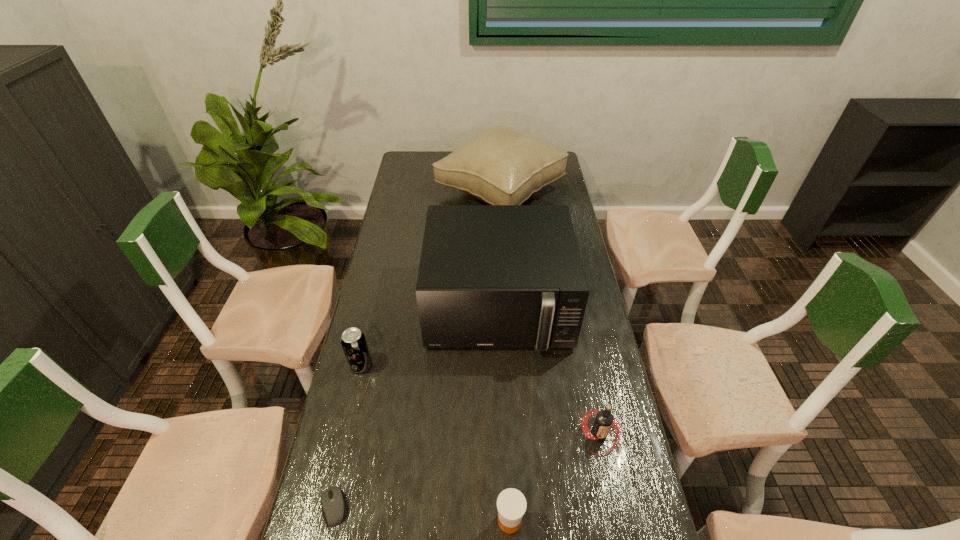
Where is `object at the far right corner`? object at the far right corner is located at coordinates (501, 165).

In the image, there is a desktop. Where is `vacant space at the left edge`? vacant space at the left edge is located at coordinates (403, 212).

Image resolution: width=960 pixels, height=540 pixels. In the image, there is a desktop. In order to click on vacant region at the right edge in this screenshot , I will do `click(573, 397)`.

You are a GUI agent. You are given a task and a screenshot of the screen. Output one action in this format:
    pyautogui.click(x=<x>, y=<y>)
    Task: Click on the unoccupied area between the medicine and the microwave oven
    The image size is (960, 540).
    Given the screenshot: What is the action you would take?
    pyautogui.click(x=504, y=414)

Identify the location of free space between the shortest object and the microwave oven. (416, 407).

Identify the location of vacant point located between the computer equipment and the microwave oven. This screenshot has height=540, width=960. (416, 407).

Locate an element on the screen. This screenshot has width=960, height=540. free space between the cushion and the second shortest object is located at coordinates (504, 356).

This screenshot has width=960, height=540. I want to click on vacant region between the microwave oven and the root beer, so click(549, 370).

Find the location of a particular element. This screenshot has height=540, width=960. vacant space that's between the microwave oven and the root beer is located at coordinates (549, 370).

Find the location of a particular element. The image size is (960, 540). the closest object to the soda can is located at coordinates (490, 276).